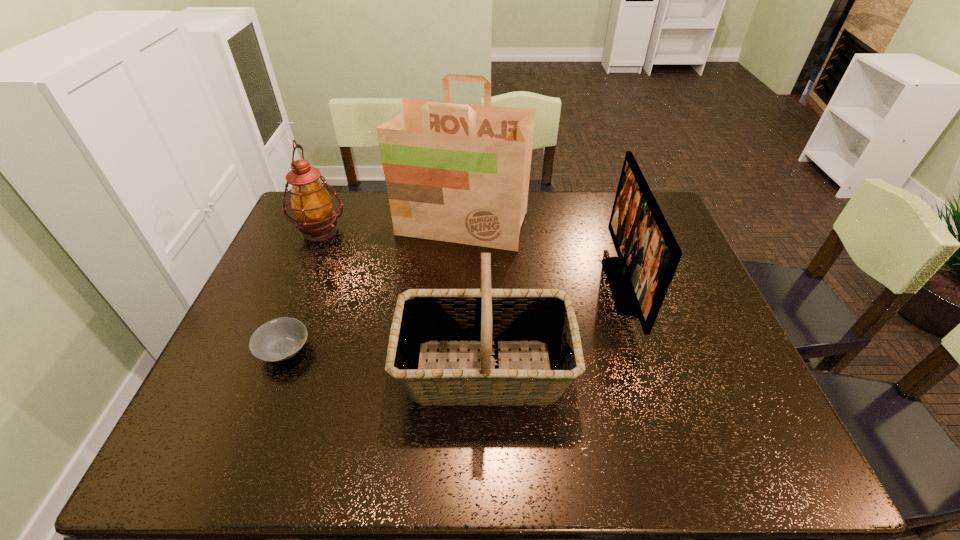
Image resolution: width=960 pixels, height=540 pixels. Identify the location of free space located by the handle of the basket. (314, 371).

Where is `free point located by the handle of the basket`? The height and width of the screenshot is (540, 960). free point located by the handle of the basket is located at coordinates (352, 371).

Image resolution: width=960 pixels, height=540 pixels. I want to click on vacant area located by the handle of the basket, so click(x=246, y=371).

Image resolution: width=960 pixels, height=540 pixels. In order to click on free region located 0.210m on the front of the shortest object in this screenshot , I will do `click(240, 462)`.

Identify the location of grocery bag at the far edge. The image size is (960, 540). (459, 173).

At what (x,y) coordinates should I click in order to perform the action: click on oil lamp that is at the far edge. Please return your answer as a coordinate pair (x, y). Looking at the image, I should click on (312, 205).

This screenshot has width=960, height=540. I want to click on oil lamp at the left edge, so click(312, 205).

Where is `bowl that is at the left edge`? The width and height of the screenshot is (960, 540). bowl that is at the left edge is located at coordinates (279, 339).

Find the location of a particular element. The image size is (960, 540). object that is at the far left corner is located at coordinates (312, 205).

This screenshot has width=960, height=540. In the image, there is a desktop. In order to click on vacant region at the far edge in this screenshot , I will do `click(566, 220)`.